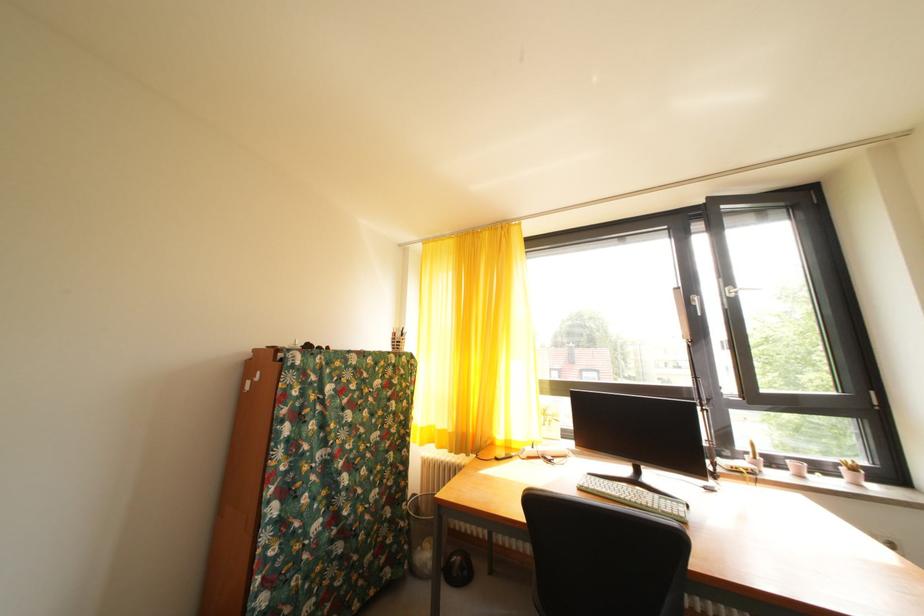
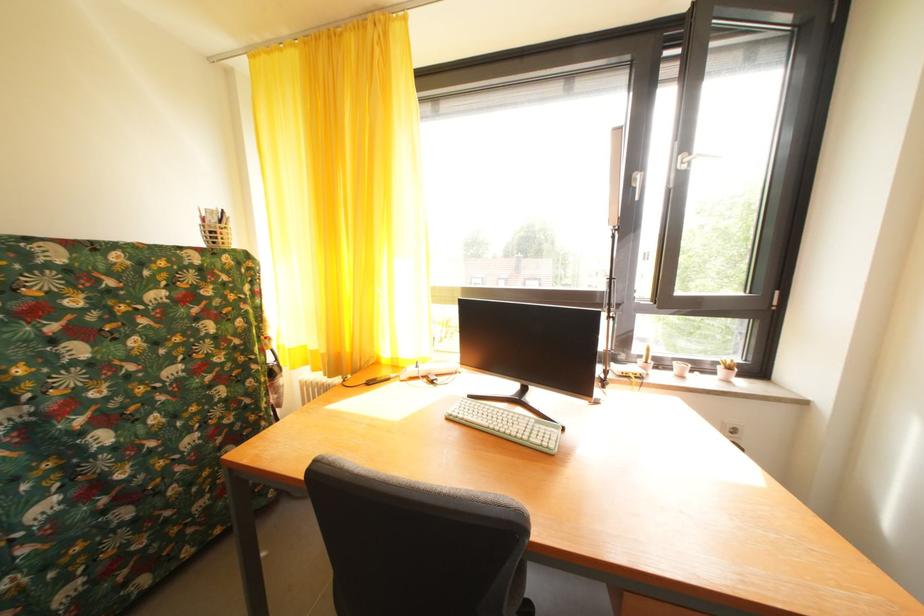
Locate, in the second image, the point that corresponds to point (399, 342) in the first image.

(209, 229)